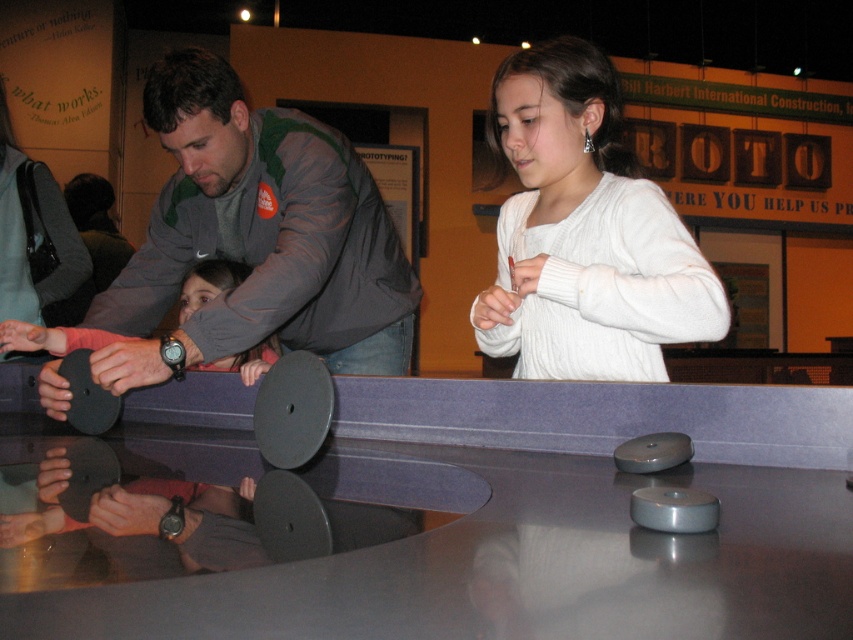
You are standing at the point labeled point (633, 228) in the exhibit. If the camera is 1.26 meters away from you, can you safely walk towards the camera without bumping into it?

Yes, since the distance between you and the camera is 1.26 meters, which is enough space to walk safely without bumping into it.